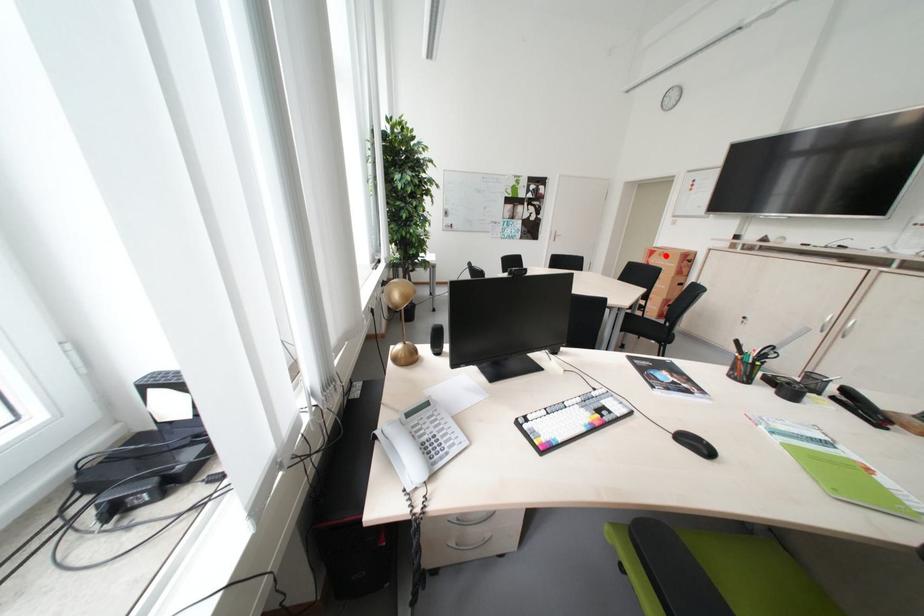
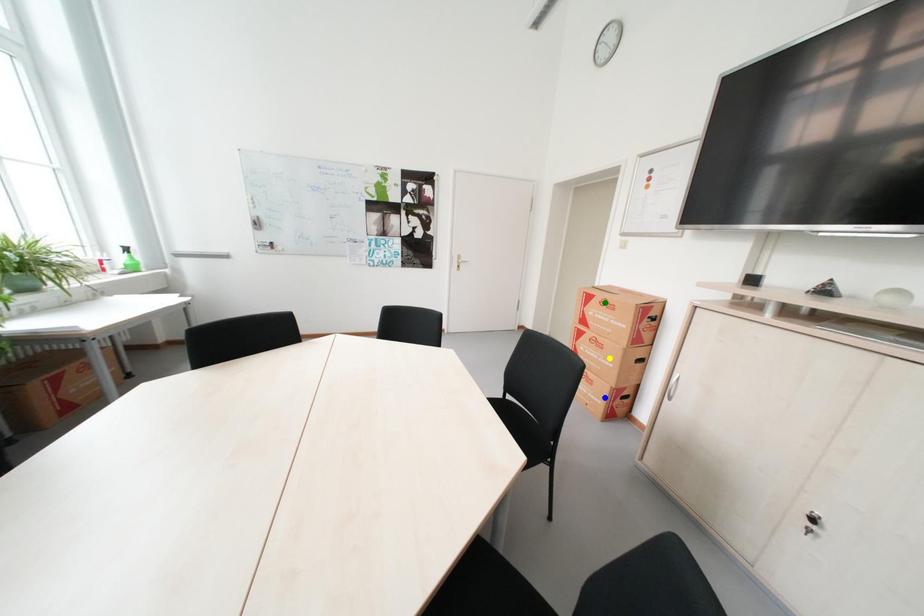
Question: I am providing you with two images of the same scene from different viewpoints. A red point is marked on the first image. You are given multiple points on the second image. Which spot in image 2 lines up with the point in image 1?

Choices:
 (A) yellow point
 (B) blue point
 (C) green point

Answer: (C)